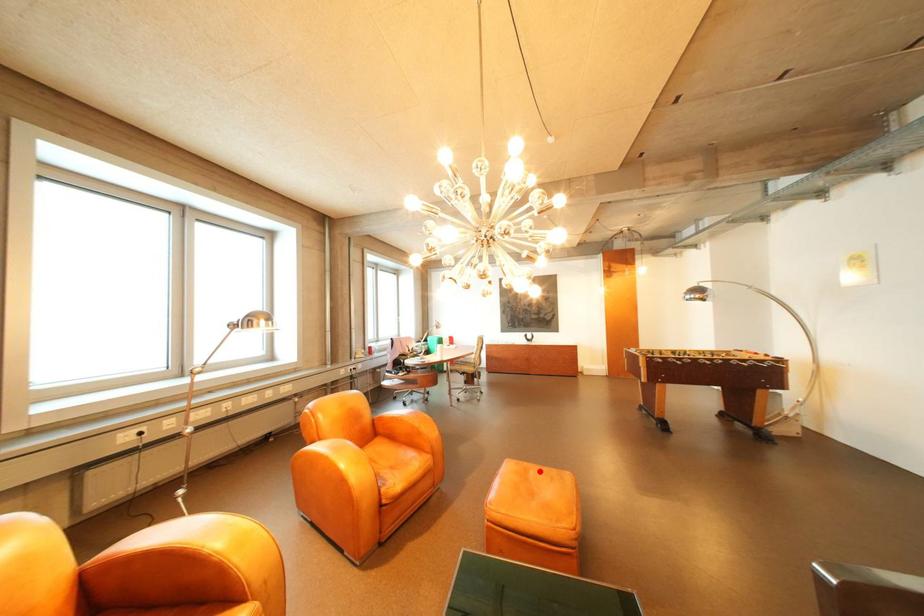
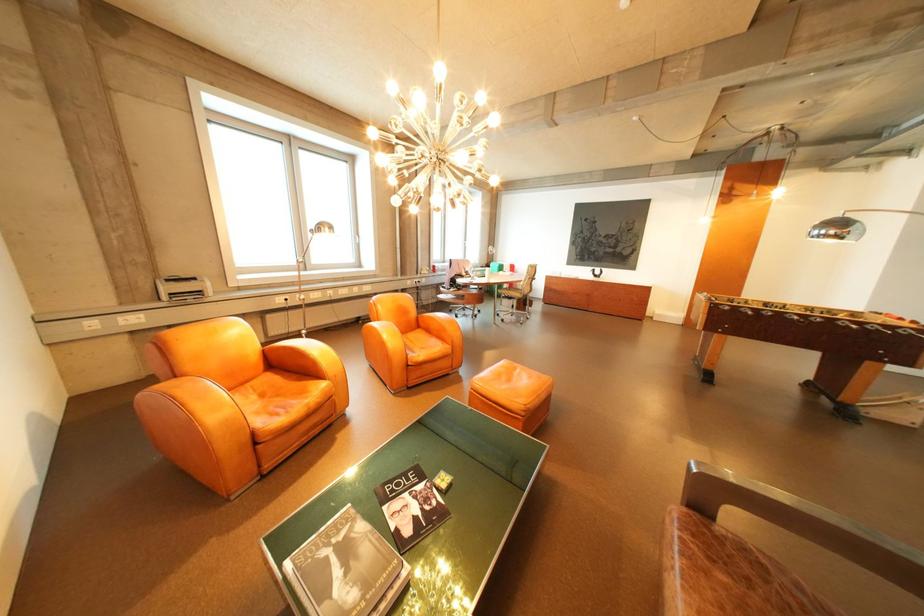
Question: I am providing you with two images of the same scene from different viewpoints. A red point is marked on the first image. Can you still see the location of the red point in image 2?

Choices:
 (A) Yes
 (B) No

Answer: (A)